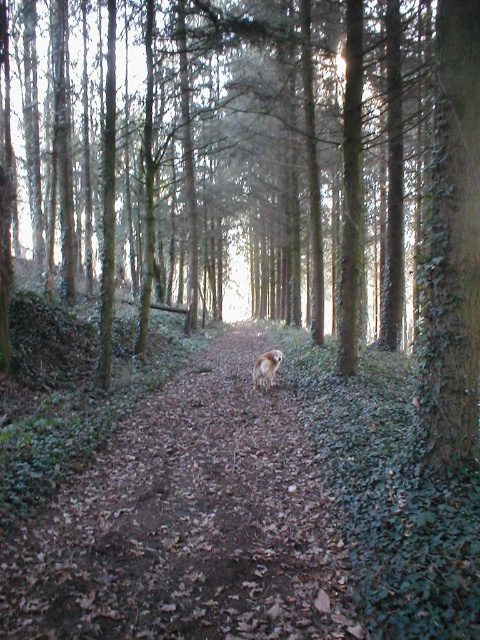
Question: Which point is closer to the camera?

Choices:
 (A) (54, 573)
 (B) (272, 360)

Answer: (A)

Question: Which point is closer to the camera?

Choices:
 (A) furry golden dog at center
 (B) brown leafy forest path at center

Answer: (B)

Question: Does brown leafy forest path at center appear on the left side of furry golden dog at center?

Choices:
 (A) no
 (B) yes

Answer: (B)

Question: Does brown leafy forest path at center have a greater width compared to furry golden dog at center?

Choices:
 (A) no
 (B) yes

Answer: (B)

Question: Which point is closer to the camera?

Choices:
 (A) (255, 384)
 (B) (115, 536)

Answer: (B)

Question: In this image, where is brown leafy forest path at center located relative to furry golden dog at center?

Choices:
 (A) above
 (B) below

Answer: (B)